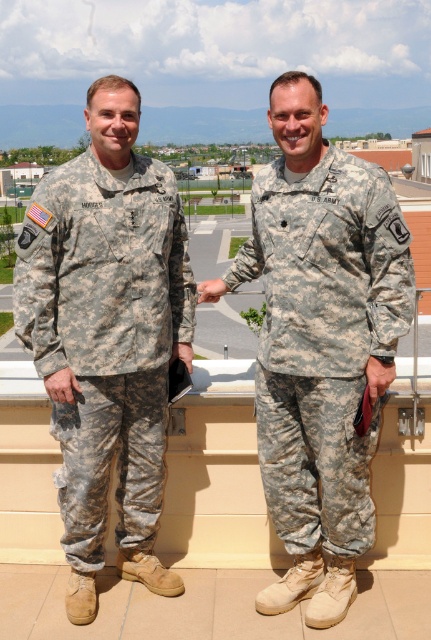
You are an observer looking at the scene. Where is the camouflage fabric uniform at left located in terms of its 2D coordinates?

The camouflage fabric uniform at left is located at the 2D coordinates of point [106,337].

In the scene shown: You are a military photographer tasked with capturing a photo of the two soldiers in their camouflage fabric uniforms. The camera you are using has a minimum focusing distance of 20 inches. Can you take a clear photo of both the camouflage fabric uniform at left and the camouflage fabric uniform at center without moving the camera or the subjects?

The camouflage fabric uniform at left and camouflage fabric uniform at center are 22.87 inches apart, which is greater than the camera minimum focusing distance of 20 inches. Therefore, you can take a clear photo of both uniforms without moving the camera or the subjects.

You are a tailor who needs to adjust the uniforms to ensure they fit properly. Given that you have only one size of fabric available, which uniform between the camouflage fabric uniform at left and the camouflage fabric uniform at center would require more fabric to alter to match the other?

The camouflage fabric uniform at left has a smaller size compared to camouflage fabric uniform at center. Therefore, to match the size of the camouflage fabric uniform at center, the smaller uniform at left would require more fabric since it needs to be enlarged.